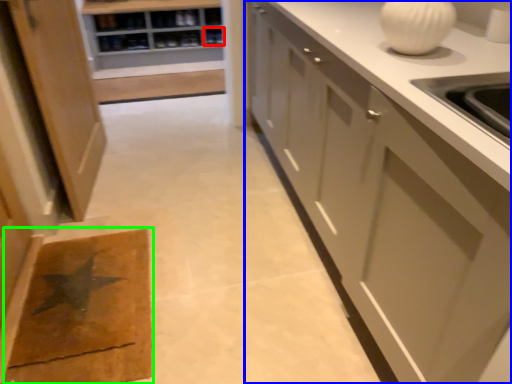
Question: Which object is the farthest from shelf (highlighted by a red box)? Choose among these: cabinetry (highlighted by a blue box) or doormat (highlighted by a green box).

Choices:
 (A) cabinetry
 (B) doormat

Answer: (B)